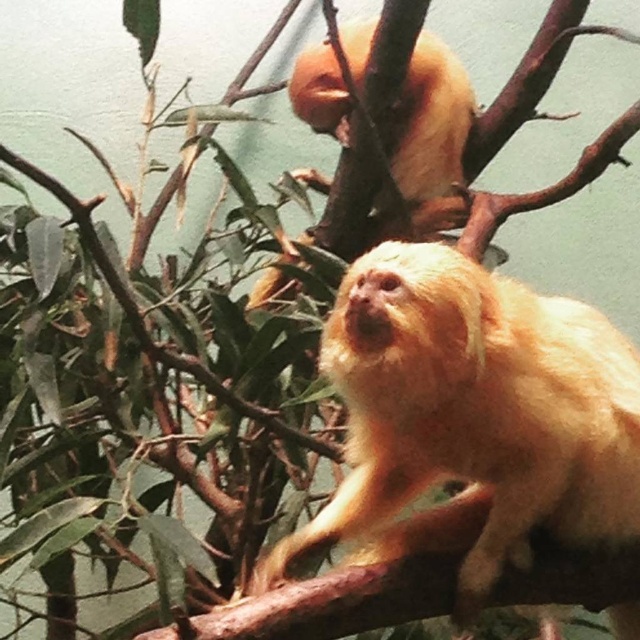
You are a zookeeper who needs to feed the golden fur monkey at center. You have a feeding tool that can extend up to 5 feet. Can you reach the monkey with the tool?

The golden fur monkey at center is 4.76 feet away from the camera, so yes, the feeding tool can reach it since it extends up to 5 feet.

You are a zookeeper observing two golden fur monkeys in their enclosure. You need to determine the spatial relationship between the golden fur monkey at center and the golden fur monkey at upper center. Which monkey is closer to you?

The golden fur monkey at center is closer to you because it is in front of the golden fur monkey at upper center.

You are a zookeeper trying to locate the golden fur monkey at center in the zoo enclosure. You have a map with coordinates. The point marked at coordinate point (476,408) on the map corresponds to a location in the enclosure. Where is this point located?

The point marked at coordinate point (476,408) is located on the golden fur monkey at center.